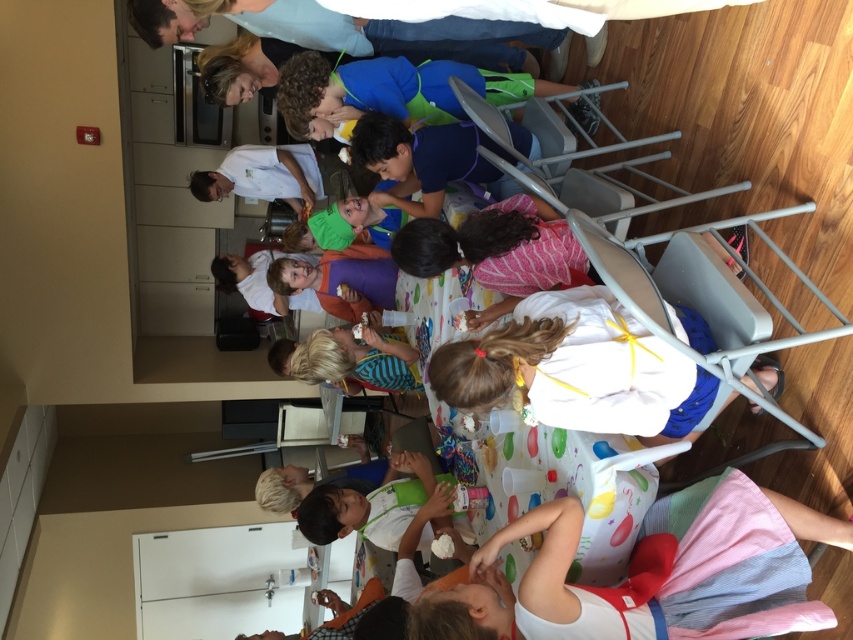
Question: Where is white cotton dress at lower right located in relation to white fabric shirt at center in the image?

Choices:
 (A) right
 (B) left

Answer: (B)

Question: Considering the real-world distances, which object is farthest from the blue fabric shirt at upper center?

Choices:
 (A) white matte shirt at center
 (B) white cotton dress at lower right
 (C) white fabric shirt at center

Answer: (B)

Question: Does white cotton dress at lower right have a greater width compared to light brown hair at center?

Choices:
 (A) no
 (B) yes

Answer: (B)

Question: Which point appears closest to the camera in this image?

Choices:
 (A) (524, 99)
 (B) (244, 179)

Answer: (A)

Question: Observing the image, what is the correct spatial positioning of blue fabric shirt at upper center in reference to blue fabric shirt at center?

Choices:
 (A) below
 (B) above

Answer: (B)

Question: Which object is the closest to the blue fabric shirt at upper center?

Choices:
 (A) blue fabric shirt at center
 (B) white fabric shirt at center
 (C) light brown hair at center

Answer: (A)